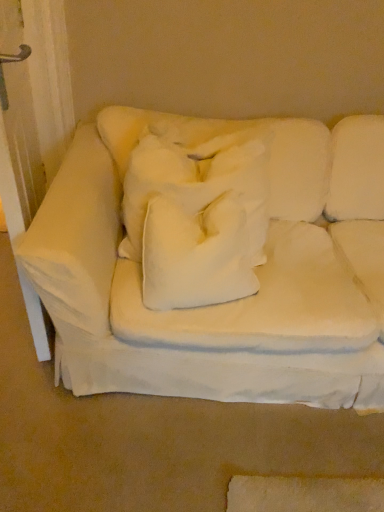
Where is `white fabric couch at center`? The image size is (384, 512). white fabric couch at center is located at coordinates (205, 265).

Describe the element at coordinates (205, 265) in the screenshot. I see `white fabric couch at center` at that location.

What do you see at coordinates (199, 252) in the screenshot? I see `white soft cushion at center` at bounding box center [199, 252].

This screenshot has width=384, height=512. Identify the location of white soft cushion at center. (199, 252).

Measure the distance between white soft cushion at center and camera.

white soft cushion at center and camera are 3.94 feet apart from each other.

Measure the distance between point (217, 231) and camera.

A distance of 1.22 meters exists between point (217, 231) and camera.

At what (x,y) coordinates should I click in order to perform the action: click on white fabric couch at center. Please return your answer as a coordinate pair (x, y). Looking at the image, I should click on click(x=205, y=265).

Is white fabric couch at center to the left of white soft cushion at center from the viewer's perspective?

Incorrect, white fabric couch at center is not on the left side of white soft cushion at center.

Does white fabric couch at center lie in front of white soft cushion at center?

Yes, it is.

Is point (307, 393) less distant than point (230, 234)?

No.

From the image's perspective, is white fabric couch at center under white soft cushion at center?

No, from the image's perspective, white fabric couch at center is not below white soft cushion at center.

From a real-world perspective, does white fabric couch at center stand above white soft cushion at center?

No, from a real-world perspective, white fabric couch at center is not above white soft cushion at center.

Between white fabric couch at center and white soft cushion at center, which one has larger width?

white fabric couch at center is wider.

Can you confirm if white fabric couch at center is shorter than white soft cushion at center?

Incorrect, the height of white fabric couch at center does not fall short of that of white soft cushion at center.

Considering the sizes of objects white fabric couch at center and white soft cushion at center in the image provided, who is smaller, white fabric couch at center or white soft cushion at center?

Smaller between the two is white soft cushion at center.

Is white fabric couch at center situated inside white soft cushion at center or outside?

white fabric couch at center exists outside the volume of white soft cushion at center.

Are white fabric couch at center and white soft cushion at center making contact?

No.

Is white fabric couch at center positioned with its back to white soft cushion at center?

Yes, white fabric couch at center is positioned with its back facing white soft cushion at center.

How far apart are white fabric couch at center and white soft cushion at center?

The distance of white fabric couch at center from white soft cushion at center is 6.26 inches.

The width and height of the screenshot is (384, 512). I want to click on studio couch in front of the white soft cushion at center, so click(x=205, y=265).

Is white soft cushion at center to the left of white fabric couch at center from the viewer's perspective?

Indeed, white soft cushion at center is positioned on the left side of white fabric couch at center.

Consider the image. Is the position of white soft cushion at center less distant than that of white fabric couch at center?

No, it is behind white fabric couch at center.

Is point (240, 288) positioned in front of point (178, 138)?

Yes, it is.

From the image's perspective, is white soft cushion at center located above white fabric couch at center?

Actually, white soft cushion at center appears below white fabric couch at center in the image.

From a real-world perspective, is white soft cushion at center physically above white fabric couch at center?

Yes, from a real-world perspective, white soft cushion at center is on top of white fabric couch at center.

Considering the sizes of white soft cushion at center and white fabric couch at center in the image, is white soft cushion at center wider or thinner than white fabric couch at center?

Considering their sizes, white soft cushion at center looks slimmer than white fabric couch at center.

Can you confirm if white soft cushion at center is shorter than white fabric couch at center?

Yes, white soft cushion at center is shorter than white fabric couch at center.

Is white soft cushion at center bigger than white fabric couch at center?

Actually, white soft cushion at center might be smaller than white fabric couch at center.

Based on the photo, is white soft cushion at center situated inside white fabric couch at center or outside?

white soft cushion at center is inside white fabric couch at center.

Is white soft cushion at center with white fabric couch at center?

No, white soft cushion at center is not next to white fabric couch at center.

Is white fabric couch at center at the back of white soft cushion at center?

That's right, white soft cushion at center is facing away from white fabric couch at center.

Can you tell me how much white soft cushion at center and white fabric couch at center differ in facing direction?

They differ by 6.34 degrees in their facing directions.

Measure the distance from white soft cushion at center to white fabric couch at center.

white soft cushion at center and white fabric couch at center are 15.91 centimeters apart.

This screenshot has width=384, height=512. I want to click on studio couch that is above the white soft cushion at center (from the image's perspective), so click(x=205, y=265).

In the image, there is a white fabric couch at center. At what (x,y) coordinates should I click in order to perform the action: click on pillow below it (from the image's perspective). Please return your answer as a coordinate pair (x, y). This screenshot has width=384, height=512. Looking at the image, I should click on (199, 252).

The height and width of the screenshot is (512, 384). Find the location of `studio couch below the white soft cushion at center (from a real-world perspective)`. studio couch below the white soft cushion at center (from a real-world perspective) is located at coordinates [x=205, y=265].